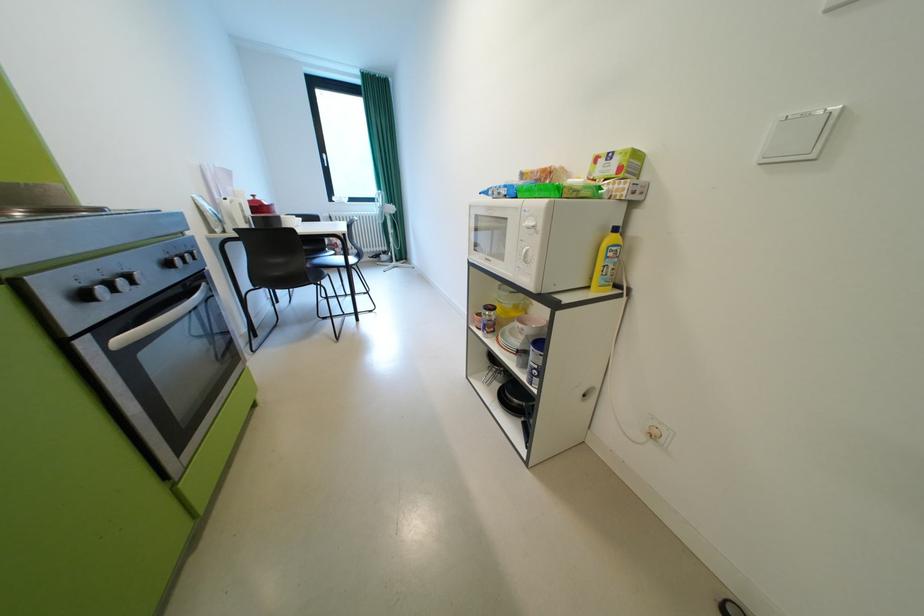
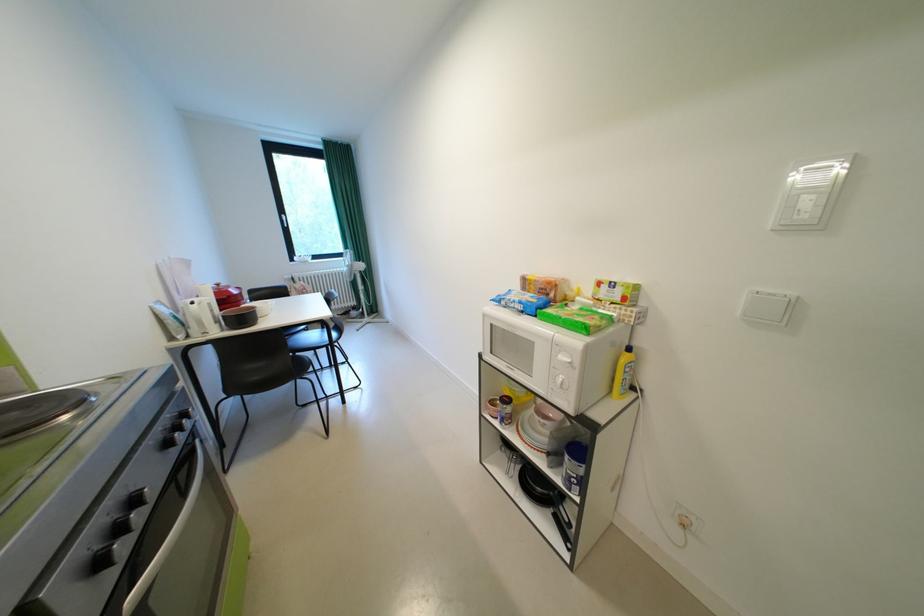
The point at (348,261) is marked in the first image. Where is the corresponding point in the second image?

(325, 337)